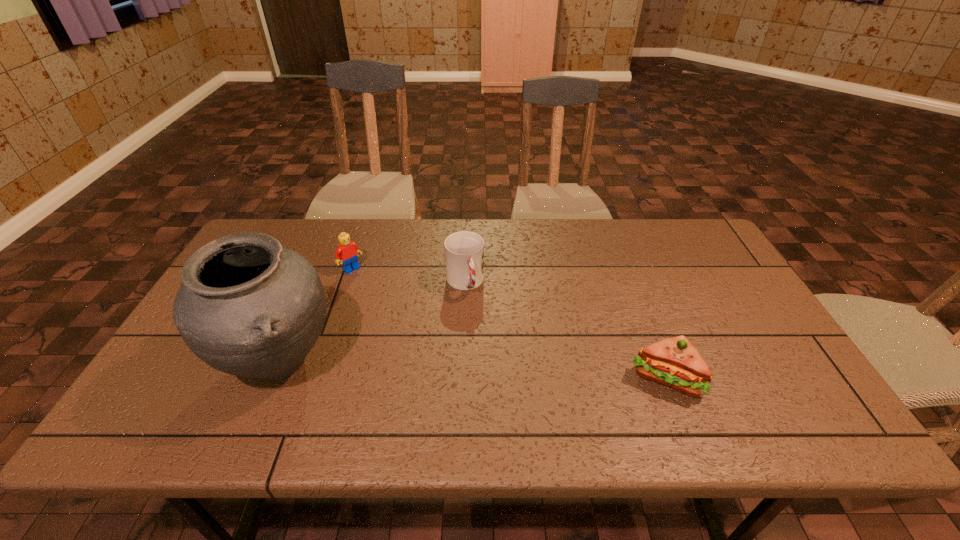
Where is `vacant space on the desktop that is between the tallest object and the sandwich and is positioned on the face of the Lego`? Image resolution: width=960 pixels, height=540 pixels. vacant space on the desktop that is between the tallest object and the sandwich and is positioned on the face of the Lego is located at coordinates (461, 369).

This screenshot has height=540, width=960. In order to click on vacant space on the desktop that is between the tallest object and the rightmost object and is positioned on the side of the third object from left to right where the handle is located in this screenshot , I will do `click(498, 371)`.